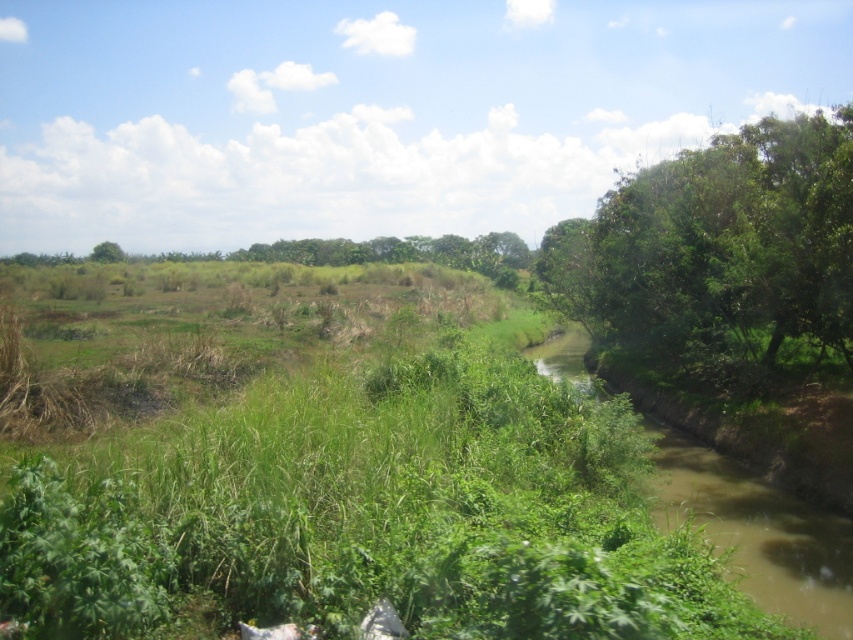
You are a hiker trying to cross the brown muddy water at right. There is a green leafy tree at right nearby. Can you use the tree to help you cross the water?

The green leafy tree at right is taller than the brown muddy water at right, so it might provide a sturdy branch or support to help you cross the water safely.

You are a hiker who wants to cross the brown muddy water at right. The coordinates of the water are given as a point. Can you determine if the water is located near the center or the edge of the image?

The coordinates of the brown muddy water at right are at point [757,531]. Since both coordinates are closer to 1, the water is located near the edge of the image.